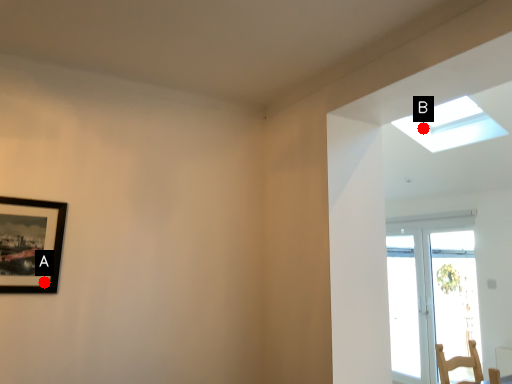
Question: Two points are circled on the image, labeled by A and B beside each circle. Which of the following is the closest to the observer?

Choices:
 (A) A is closer
 (B) B is closer

Answer: (A)